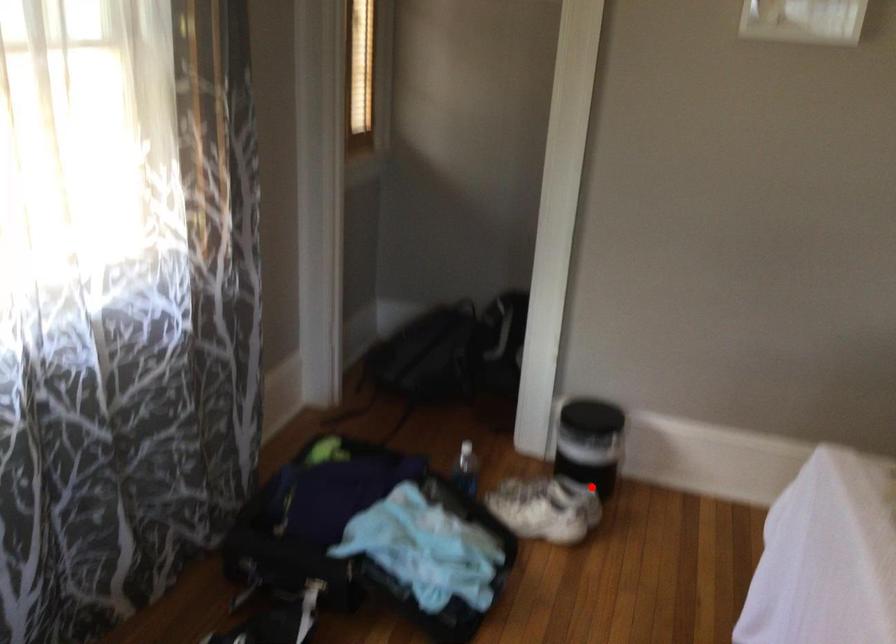
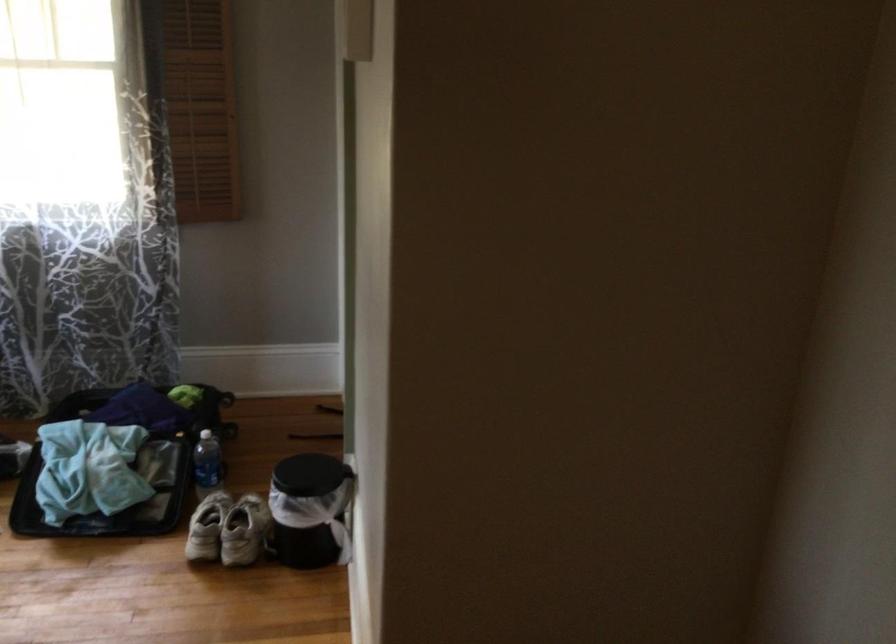
Where in the second image is the point corresponding to the highlighted location from the first image?

(244, 531)